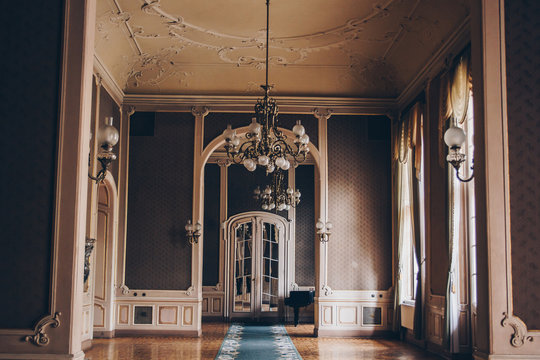
You are a GUI agent. You are given a task and a screenshot of the screen. Output one action in this format:
    pyautogui.click(x=<x>, y=<y>)
    Task: Click on the small brown table
    The height and width of the screenshot is (360, 540).
    Given the screenshot: What is the action you would take?
    pyautogui.click(x=299, y=300)